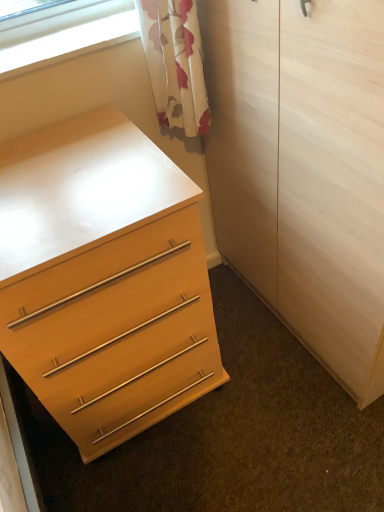
Identify the location of vacant space situated above matte wood chest of drawers at lower left (from a real-world perspective). (69, 178).